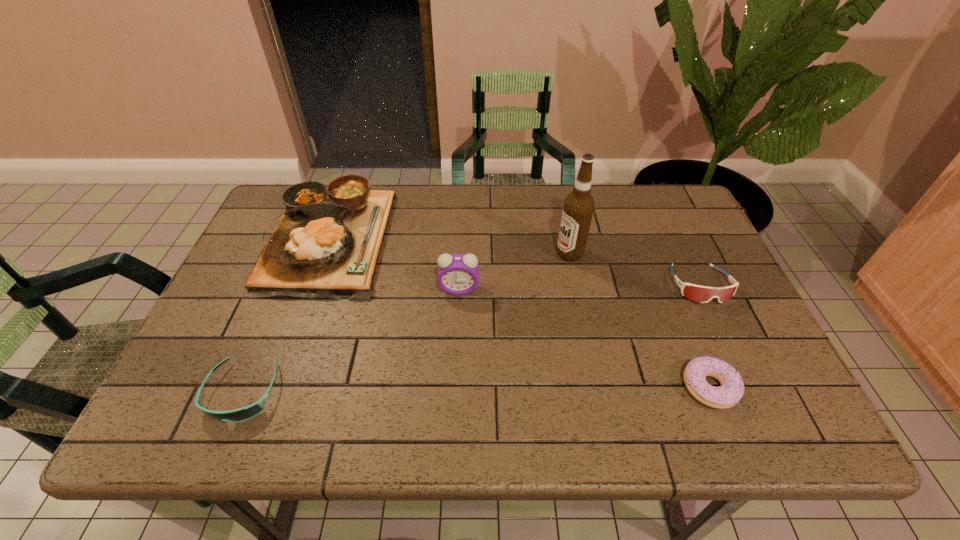
At what (x,y) coordinates should I click in order to perform the action: click on goggles present at the right edge. Please return your answer as a coordinate pair (x, y). Looking at the image, I should click on (702, 294).

This screenshot has height=540, width=960. I want to click on doughnut positioned at the right edge, so click(x=727, y=395).

This screenshot has height=540, width=960. I want to click on object that is at the far left corner, so click(326, 245).

Where is `object situated at the near left corner`? The height and width of the screenshot is (540, 960). object situated at the near left corner is located at coordinates (241, 414).

Locate an element on the screen. The width and height of the screenshot is (960, 540). object situated at the near right corner is located at coordinates (727, 395).

This screenshot has width=960, height=540. Find the location of `vacant space at the far edge of the desktop`. vacant space at the far edge of the desktop is located at coordinates (467, 203).

Where is `vacant position at the near edge of the desktop`? The width and height of the screenshot is (960, 540). vacant position at the near edge of the desktop is located at coordinates (522, 428).

Find the location of a particular element. The width and height of the screenshot is (960, 540). free space at the left edge is located at coordinates (248, 328).

Where is `vacant space at the right edge`? vacant space at the right edge is located at coordinates (682, 233).

This screenshot has width=960, height=540. What are the coordinates of `vacant space at the near left corner` in the screenshot? It's located at [200, 403].